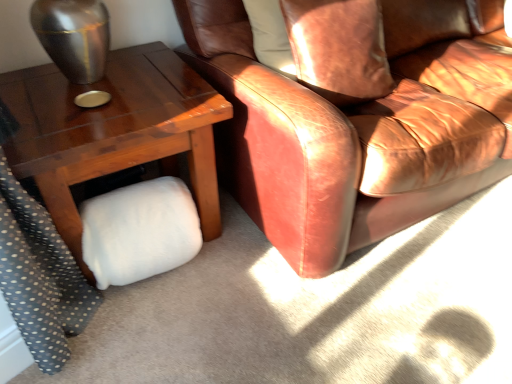
Question: Considering the relative sizes of leather couch at center and wooden table at lower left in the image provided, is leather couch at center bigger than wooden table at lower left?

Choices:
 (A) yes
 (B) no

Answer: (A)

Question: Is leather couch at center closer to the viewer compared to wooden table at lower left?

Choices:
 (A) no
 (B) yes

Answer: (B)

Question: Is leather couch at center facing away from wooden table at lower left?

Choices:
 (A) yes
 (B) no

Answer: (B)

Question: Is leather couch at center at the left side of wooden table at lower left?

Choices:
 (A) yes
 (B) no

Answer: (B)

Question: Does leather couch at center have a greater width compared to wooden table at lower left?

Choices:
 (A) no
 (B) yes

Answer: (B)

Question: Considering the positions of white fluffy pillow at lower left and wooden table at lower left in the image, is white fluffy pillow at lower left wider or thinner than wooden table at lower left?

Choices:
 (A) thin
 (B) wide

Answer: (A)

Question: Considering the positions of white fluffy pillow at lower left and wooden table at lower left in the image, is white fluffy pillow at lower left taller or shorter than wooden table at lower left?

Choices:
 (A) tall
 (B) short

Answer: (B)

Question: Would you say white fluffy pillow at lower left is inside or outside wooden table at lower left?

Choices:
 (A) outside
 (B) inside

Answer: (B)

Question: Based on their positions, is white fluffy pillow at lower left located to the left or right of wooden table at lower left?

Choices:
 (A) left
 (B) right

Answer: (B)

Question: Would you say leather couch at center is inside or outside leather pillow at upper right?

Choices:
 (A) outside
 (B) inside

Answer: (A)

Question: Looking at the image, does leather couch at center seem bigger or smaller compared to leather pillow at upper right?

Choices:
 (A) small
 (B) big

Answer: (B)

Question: Is leather couch at center taller or shorter than leather pillow at upper right?

Choices:
 (A) tall
 (B) short

Answer: (A)

Question: In terms of width, does leather couch at center look wider or thinner when compared to leather pillow at upper right?

Choices:
 (A) wide
 (B) thin

Answer: (A)

Question: In the image, is leather pillow at upper right on the left side or the right side of leather couch at center?

Choices:
 (A) left
 (B) right

Answer: (A)

Question: In terms of height, does leather pillow at upper right look taller or shorter compared to leather couch at center?

Choices:
 (A) tall
 (B) short

Answer: (B)